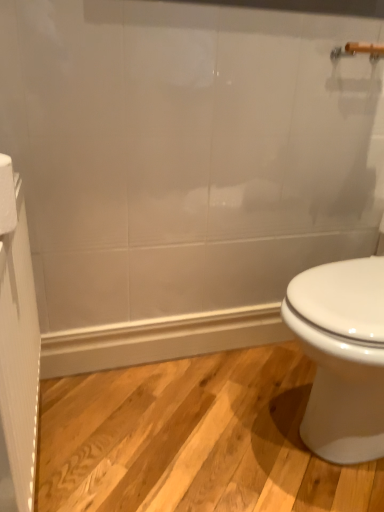
Question: Based on their sizes in the image, would you say white textured screen door at left is bigger or smaller than white paper towel at left?

Choices:
 (A) small
 (B) big

Answer: (B)

Question: Is white textured screen door at left spatially inside white paper towel at left, or outside of it?

Choices:
 (A) inside
 (B) outside

Answer: (B)

Question: Considering the positions of white textured screen door at left and white paper towel at left in the image, is white textured screen door at left taller or shorter than white paper towel at left?

Choices:
 (A) tall
 (B) short

Answer: (A)

Question: In the image, is white paper towel at left positioned in front of or behind white textured screen door at left?

Choices:
 (A) front
 (B) behind

Answer: (B)

Question: Is white paper towel at left wider or thinner than white textured screen door at left?

Choices:
 (A) thin
 (B) wide

Answer: (B)

Question: Considering the positions of white paper towel at left and white textured screen door at left in the image, is white paper towel at left taller or shorter than white textured screen door at left?

Choices:
 (A) tall
 (B) short

Answer: (B)

Question: From the image's perspective, is white paper towel at left positioned above or below white textured screen door at left?

Choices:
 (A) below
 (B) above

Answer: (B)